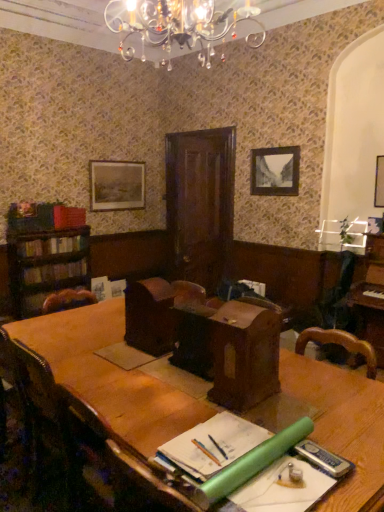
Identify the location of vacant region to the left of wooden desk at center. (191, 396).